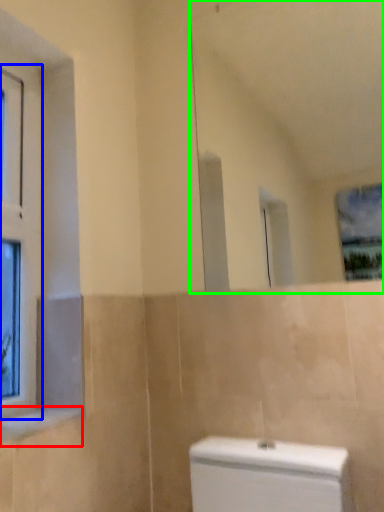
Question: Which object is positioned farthest from window sill (highlighted by a red box)? Select from window (highlighted by a blue box) and mirror (highlighted by a green box).

Choices:
 (A) window
 (B) mirror

Answer: (B)